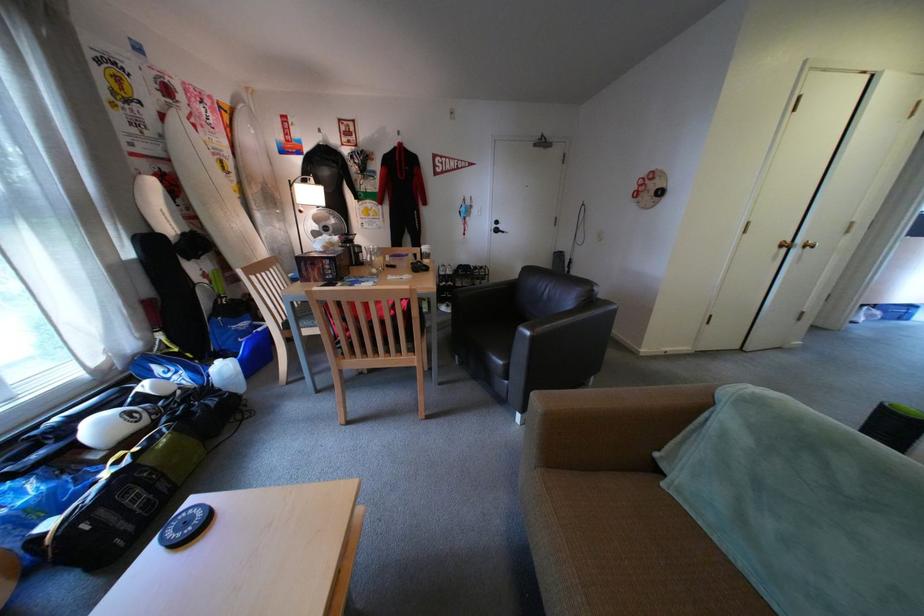
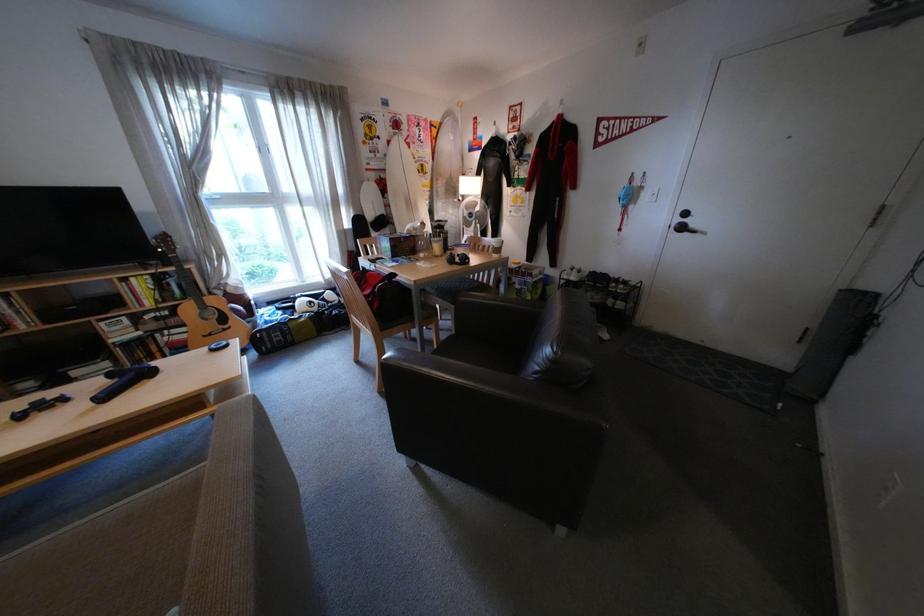
Find the pixel in the second image that matches point 161,134 in the first image.

(392, 156)